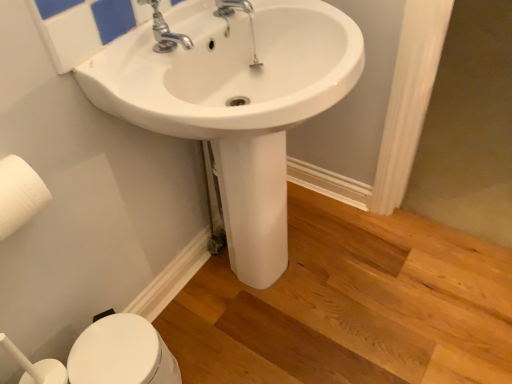
Where is `vacant area in front of polished chrome faucet at upper center`? This screenshot has height=384, width=512. vacant area in front of polished chrome faucet at upper center is located at coordinates (157, 91).